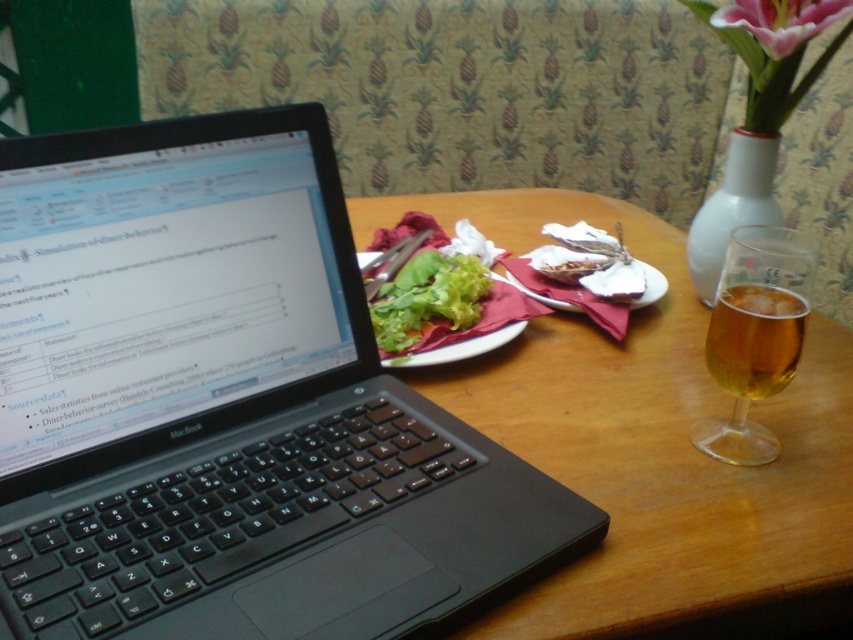
What do you see at coordinates (755, 336) in the screenshot? The image size is (853, 640). I see `translucent glass at right` at bounding box center [755, 336].

Can you confirm if translucent glass at right is positioned to the right of white glossy vase at upper right?

In fact, translucent glass at right is to the left of white glossy vase at upper right.

I want to click on translucent glass at right, so 755,336.

In the scene shown: Is black plastic laptop at left thinner than translucent glass at right?

No, black plastic laptop at left is not thinner than translucent glass at right.

Between black plastic laptop at left and translucent glass at right, which one has less height?

translucent glass at right is shorter.

Does point (216, 412) come farther from viewer compared to point (720, 460)?

No.

You are a GUI agent. You are given a task and a screenshot of the screen. Output one action in this format:
    pyautogui.click(x=<x>, y=<y>)
    Task: Click on the black plastic laptop at left
    The image size is (853, 640).
    Given the screenshot: What is the action you would take?
    pyautogui.click(x=227, y=404)

Measure the distance between point (x=747, y=337) and camera.

Point (x=747, y=337) is 23.64 inches from camera.

Between translucent glass at right and translucent amber liquid at right, which one appears on the right side from the viewer's perspective?

From the viewer's perspective, translucent glass at right appears more on the right side.

Is point (753, 460) farther from camera compared to point (764, 307)?

Yes, point (753, 460) is behind point (764, 307).

You are a GUI agent. You are given a task and a screenshot of the screen. Output one action in this format:
    pyautogui.click(x=<x>, y=<y>)
    Task: Click on the translucent glass at right
    
    Given the screenshot: What is the action you would take?
    pyautogui.click(x=755, y=336)